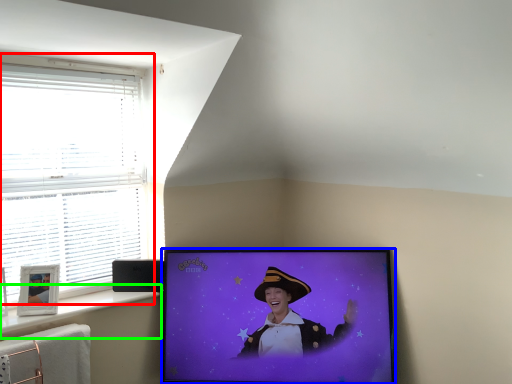
Question: Based on their relative distances, which object is nearer to window (highlighted by a red box)? Choose from television (highlighted by a blue box) and window sill (highlighted by a green box).

Choices:
 (A) television
 (B) window sill

Answer: (B)